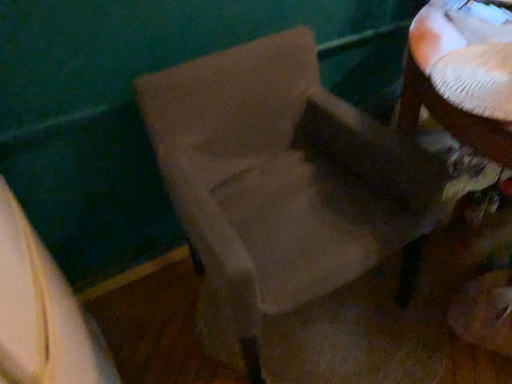
Identify the location of free space that is to the left of suede-like beige chair at center. (164, 320).